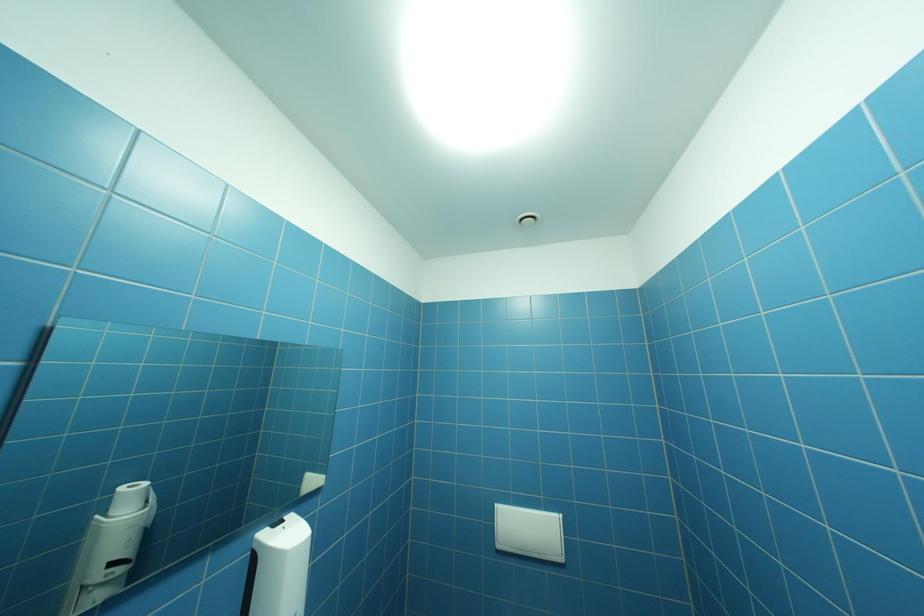
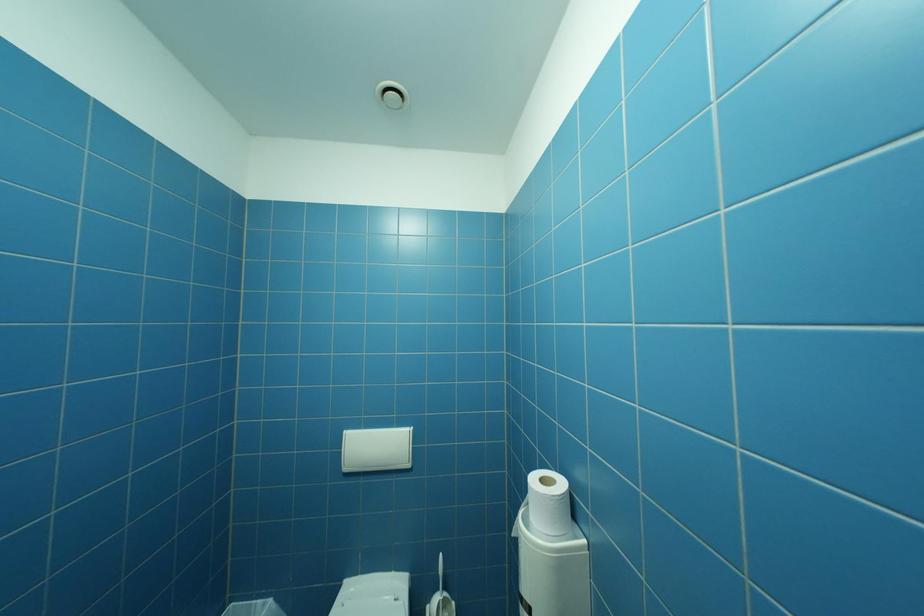
In a continuous first-person perspective shot, in which direction is the camera moving?

The cameraman moved toward right, forward.